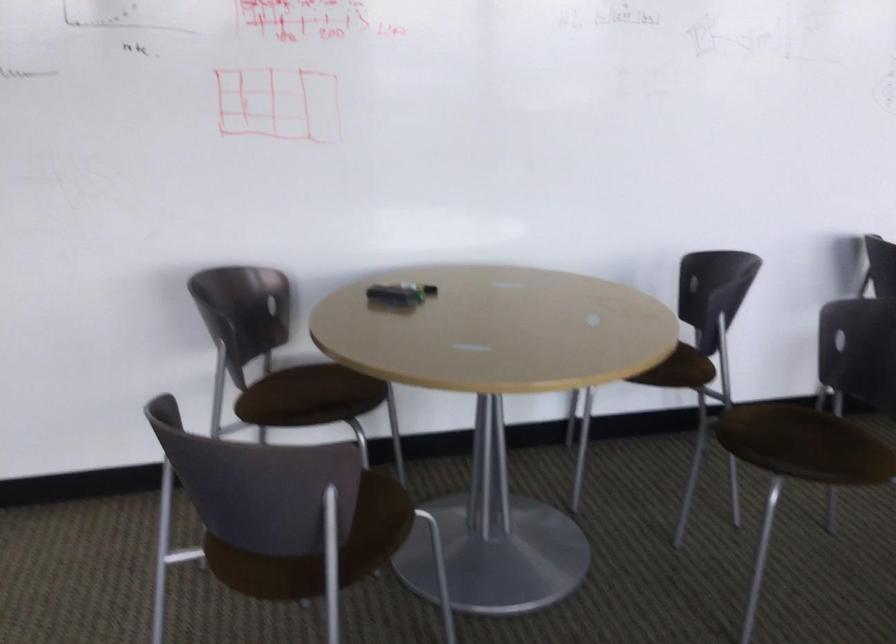
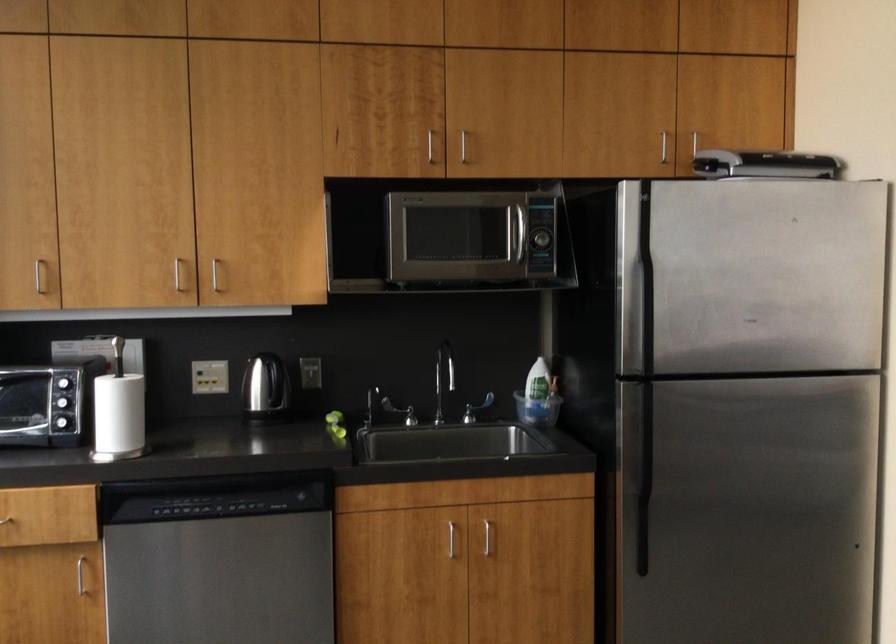
Question: The first image is from the beginning of the video and the second image is from the end. How did the camera likely rotate when shooting the video?

Choices:
 (A) Left
 (B) Right
 (C) Up
 (D) Down

Answer: (A)